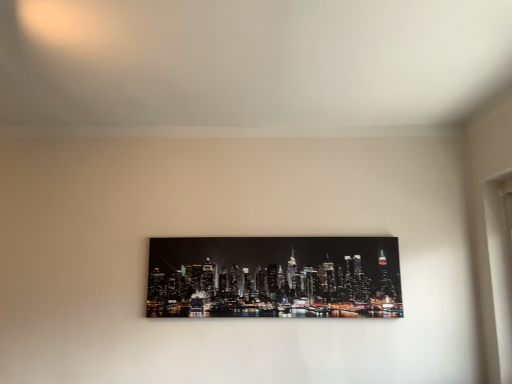
This screenshot has height=384, width=512. In order to click on metallic cityscape print at center in this screenshot , I will do `click(274, 277)`.

Describe the element at coordinates (274, 277) in the screenshot. I see `metallic cityscape print at center` at that location.

This screenshot has height=384, width=512. What are the coordinates of `metallic cityscape print at center` in the screenshot? It's located at (274, 277).